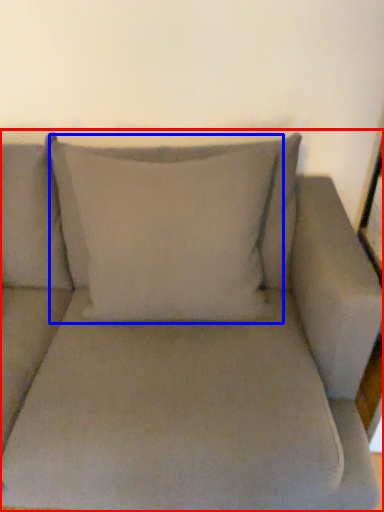
Question: Which of the following is the closest to the observer, studio couch (highlighted by a red box) or pillow (highlighted by a blue box)?

Choices:
 (A) studio couch
 (B) pillow

Answer: (A)